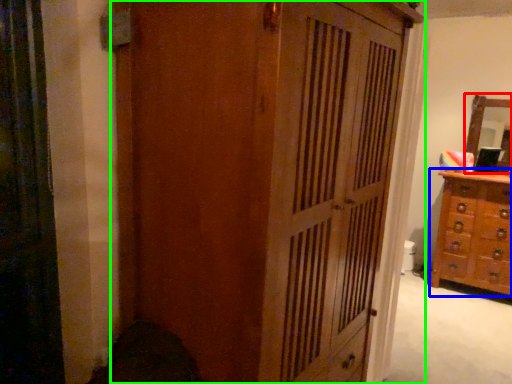
Question: Based on their relative distances, which object is farther from mirror (highlighted by a red box)? Choose from chest of drawers (highlighted by a blue box) and cupboard (highlighted by a green box).

Choices:
 (A) chest of drawers
 (B) cupboard

Answer: (B)